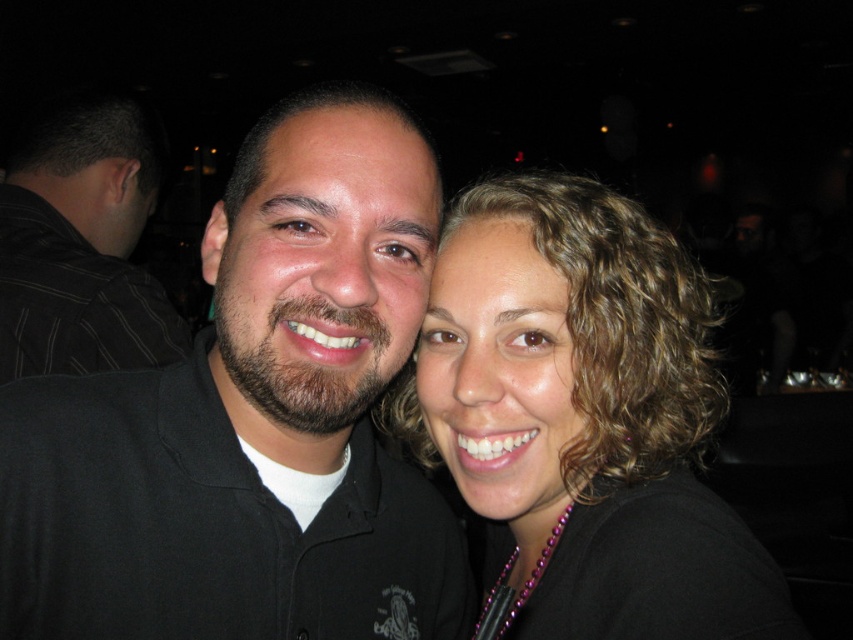
Consider the image. You are a photographer trying to adjust the focus of your camera. You notice a point at coordinates point (585,416). Where is this point located in the image?

The point (585,416) is located on the curly hair at center.

You are a photographer adjusting the focus of the camera. The camera can only focus on objects within a 0.1 unit radius around the center point at coordinates 0.5, 0.5. Will the curly hair at center be in focus?

The curly hair at center is located at point (585,416), which is outside the 0.1 unit radius from the center point (426,320). Therefore, the curly hair at center will not be in focus.

You are a photographer trying to frame a shot of the curly hair at center and the black striped shirt at left. Which object should you adjust your camera angle to focus on if you want to capture the wider one?

The curly hair at center is wider than the black striped shirt at left, so you should focus on the curly hair at center to capture the wider object.